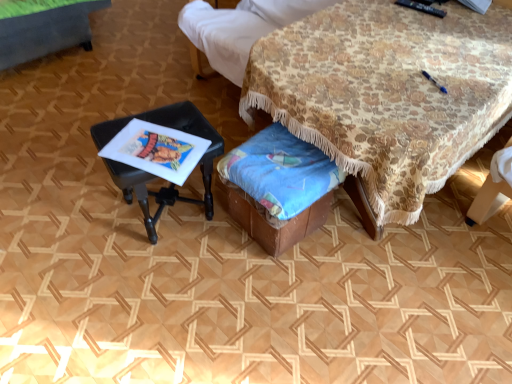
Question: Considering the relative sizes of black plastic stool at left, arranged as the 1th table when viewed from the left, and floral fabric table at center, the 1th table from the right, in the image provided, is black plastic stool at left, arranged as the 1th table when viewed from the left, taller than floral fabric table at center, the 1th table from the right,?

Choices:
 (A) yes
 (B) no

Answer: (B)

Question: Is black plastic stool at left, placed as the 2th table when sorted from right to left, in contact with floral fabric table at center, marked as the 2th table in a left-to-right arrangement?

Choices:
 (A) yes
 (B) no

Answer: (B)

Question: Can you confirm if black plastic stool at left, arranged as the 1th table when viewed from the left, is positioned to the left of floral fabric table at center, marked as the 2th table in a left-to-right arrangement?

Choices:
 (A) no
 (B) yes

Answer: (B)

Question: Is black plastic stool at left, placed as the 2th table when sorted from right to left, far from floral fabric table at center, marked as the 2th table in a left-to-right arrangement?

Choices:
 (A) no
 (B) yes

Answer: (A)

Question: From a real-world perspective, is black plastic stool at left, placed as the 2th table when sorted from right to left, physically below floral fabric table at center, the 1th table from the right?

Choices:
 (A) yes
 (B) no

Answer: (A)

Question: Is black plastic stool at left, arranged as the 1th table when viewed from the left, positioned before floral fabric table at center, marked as the 2th table in a left-to-right arrangement?

Choices:
 (A) yes
 (B) no

Answer: (B)

Question: From a real-world perspective, is blue fabric at lower center physically above black plastic stool at left, arranged as the 1th table when viewed from the left?

Choices:
 (A) no
 (B) yes

Answer: (A)

Question: Does blue fabric at lower center appear on the left side of black plastic stool at left, placed as the 2th table when sorted from right to left?

Choices:
 (A) no
 (B) yes

Answer: (A)

Question: Can you confirm if blue fabric at lower center is bigger than black plastic stool at left, placed as the 2th table when sorted from right to left?

Choices:
 (A) yes
 (B) no

Answer: (B)

Question: Is blue fabric at lower center to the right of black plastic stool at left, placed as the 2th table when sorted from right to left, from the viewer's perspective?

Choices:
 (A) yes
 (B) no

Answer: (A)

Question: Could you tell me if blue fabric at lower center is turned towards black plastic stool at left, placed as the 2th table when sorted from right to left?

Choices:
 (A) yes
 (B) no

Answer: (B)

Question: From a real-world perspective, is blue fabric at lower center located beneath black plastic stool at left, placed as the 2th table when sorted from right to left?

Choices:
 (A) no
 (B) yes

Answer: (B)

Question: Is floral fabric table at center, marked as the 2th table in a left-to-right arrangement, thinner than blue fabric at lower center?

Choices:
 (A) yes
 (B) no

Answer: (B)